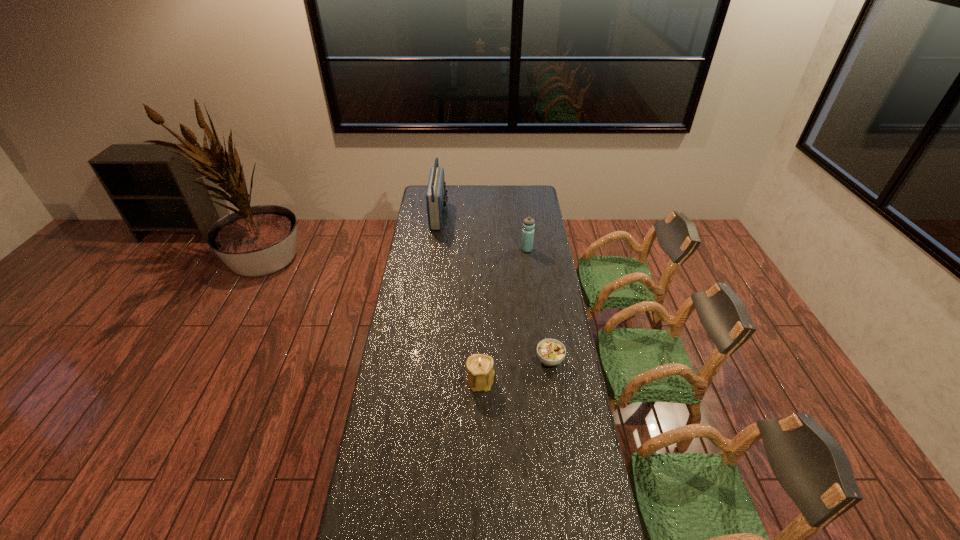
Where is `vacant space located 0.170m on the back of the soup bowl`? vacant space located 0.170m on the back of the soup bowl is located at coordinates (x=543, y=320).

Locate an element on the screen. The width and height of the screenshot is (960, 540). object that is at the far edge is located at coordinates (436, 198).

Where is `object situated at the left edge`? This screenshot has height=540, width=960. object situated at the left edge is located at coordinates (436, 198).

Find the location of a particular element. This screenshot has width=960, height=540. water bottle that is at the right edge is located at coordinates (529, 223).

At what (x,y) coordinates should I click in order to perform the action: click on soup bowl at the right edge. Please return your answer as a coordinate pair (x, y). Looking at the image, I should click on (551, 352).

You are a GUI agent. You are given a task and a screenshot of the screen. Output one action in this format:
    pyautogui.click(x=<x>, y=<y>)
    Task: Click on the object at the far left corner
    This screenshot has height=540, width=960.
    Given the screenshot: What is the action you would take?
    pyautogui.click(x=436, y=198)

In the image, there is a desktop. At what (x,y) coordinates should I click in order to perform the action: click on vacant space at the left edge. Please return your answer as a coordinate pair (x, y). Image resolution: width=960 pixels, height=540 pixels. Looking at the image, I should click on (395, 439).

Locate an element on the screen. Image resolution: width=960 pixels, height=540 pixels. vacant space at the right edge is located at coordinates (551, 335).

This screenshot has height=540, width=960. I want to click on empty space between the water bottle and the third object from right to left, so click(504, 315).

I want to click on empty location between the water bottle and the soup bowl, so click(x=539, y=305).